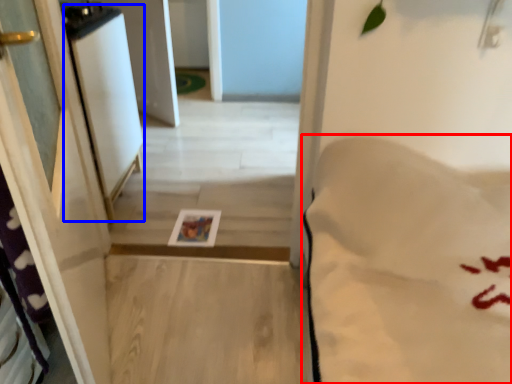
Question: Which object appears farthest to the camera in this image, sheet (highlighted by a red box) or screen door (highlighted by a blue box)?

Choices:
 (A) sheet
 (B) screen door

Answer: (B)